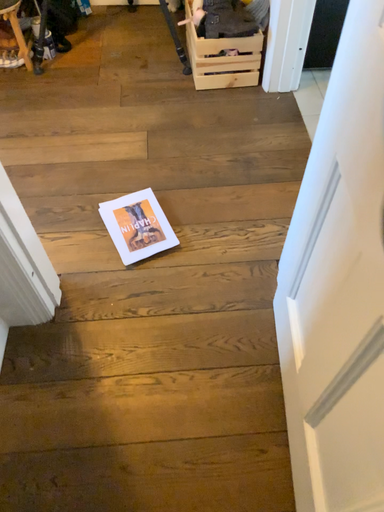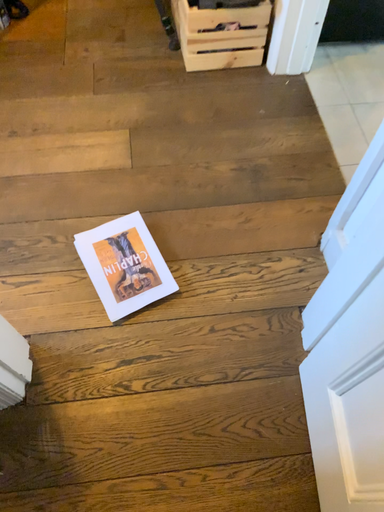
Question: How did the camera likely rotate when shooting the video?

Choices:
 (A) rotated upward
 (B) rotated downward

Answer: (B)